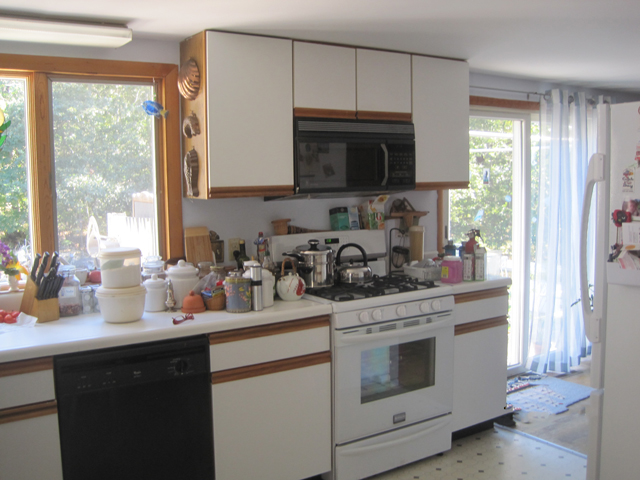
Where is `oven`? The height and width of the screenshot is (480, 640). oven is located at coordinates (395, 364).